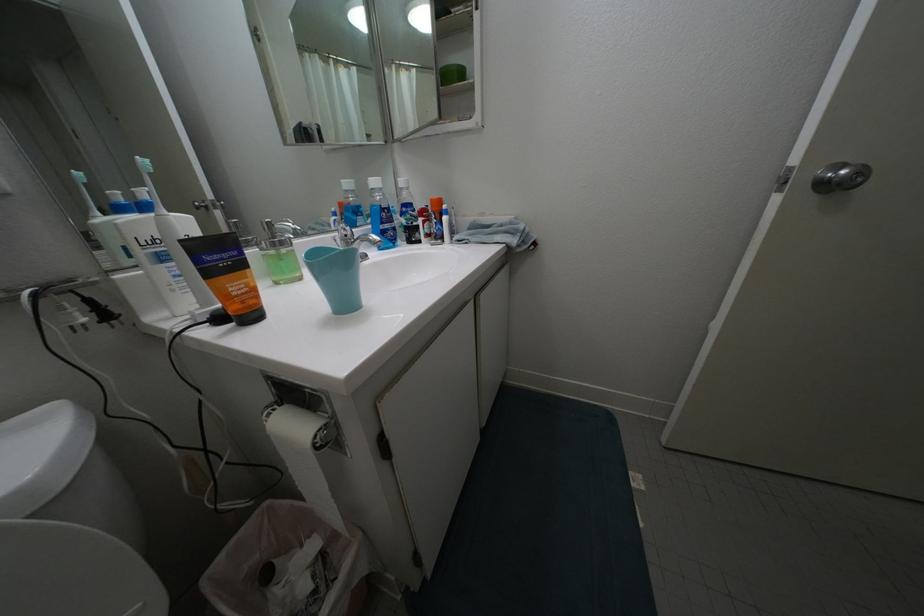
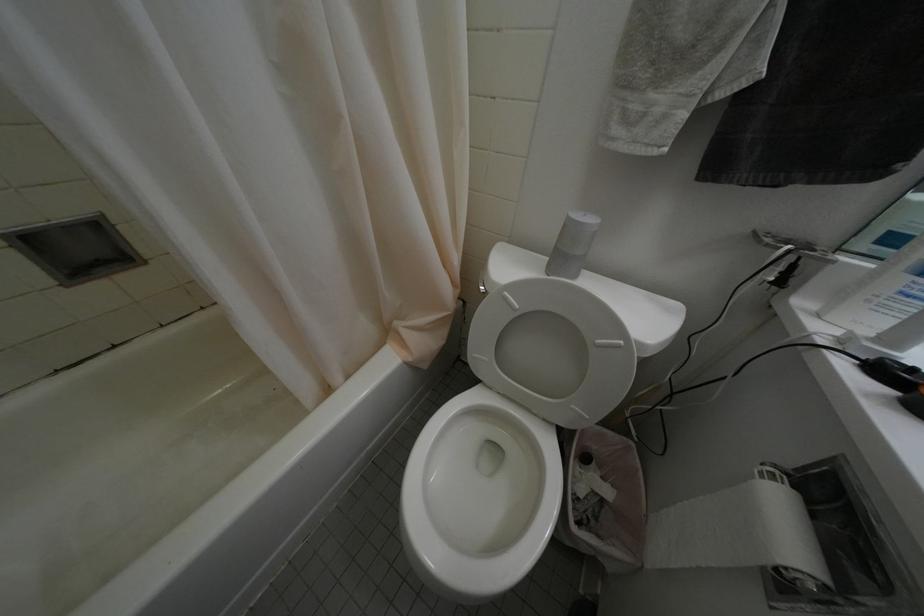
The images are taken continuously from a first-person perspective. In which direction is your viewpoint rotating?

The rotation direction of the camera is left-down.